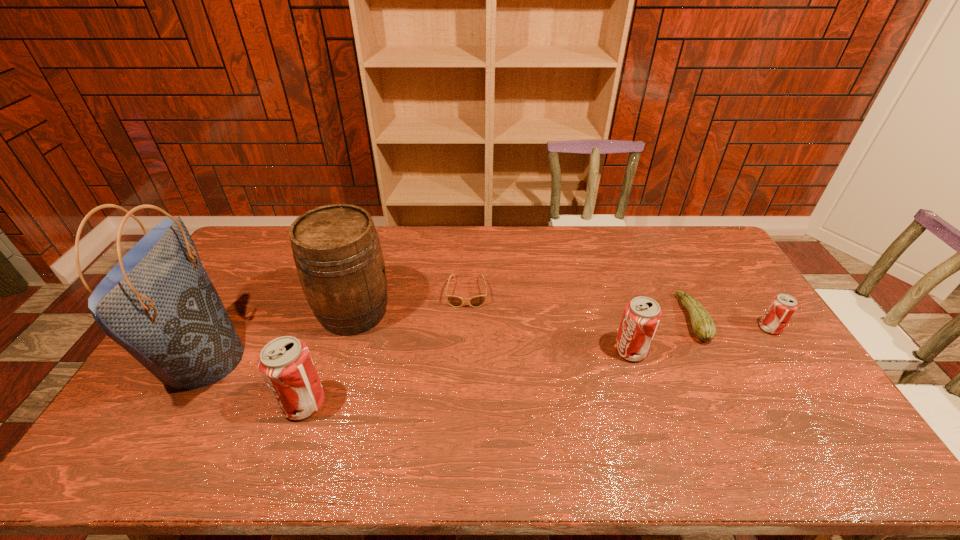
Locate an element on the screen. the nearest soda can is located at coordinates (285, 363).

Find the location of a particular element. This screenshot has width=960, height=540. the second tallest soda can is located at coordinates (642, 315).

Locate an element on the screen. Image resolution: width=960 pixels, height=540 pixels. the second soda can from right to left is located at coordinates (642, 315).

In order to click on the rightmost soda can in this screenshot , I will do `click(782, 307)`.

What are the coordinates of `the rightmost object` in the screenshot? It's located at (782, 307).

At what (x,y) coordinates should I click in order to perform the action: click on sunglasses. Please return your answer as a coordinate pair (x, y). The height and width of the screenshot is (540, 960). Looking at the image, I should click on (455, 301).

Where is `the shortest object`? Image resolution: width=960 pixels, height=540 pixels. the shortest object is located at coordinates (455, 301).

The image size is (960, 540). I want to click on the sixth tallest object, so click(704, 328).

Locate an element on the screen. zucchini is located at coordinates (704, 328).

At what (x,y) coordinates should I click in order to perform the action: click on the second tallest object. Please return your answer as a coordinate pair (x, y). Looking at the image, I should click on (337, 253).